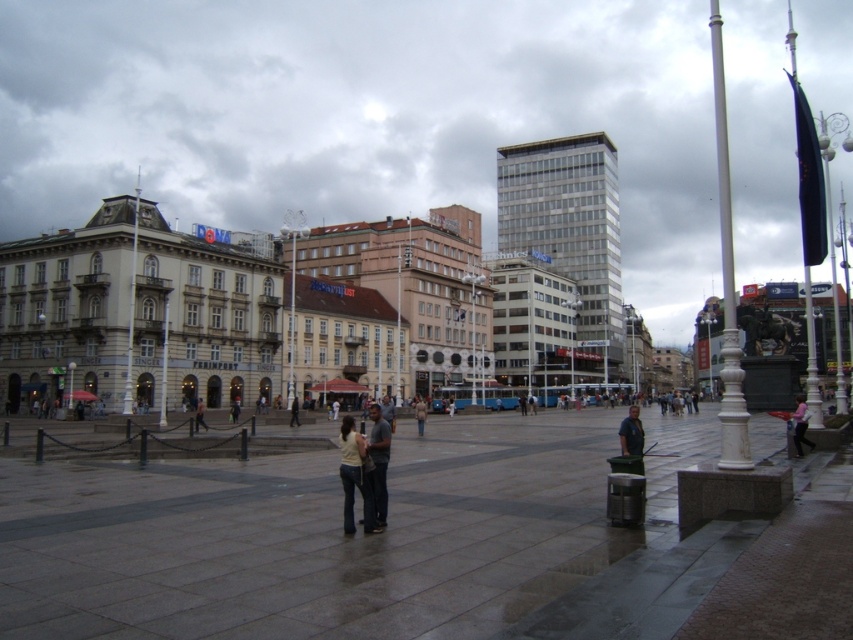
You are a photographer standing in the urban square. You notice two people wearing light beige jeans at center and denim pants at center. Which one is positioned to the right of the other?

The light beige jeans at center is to the right of denim pants at center.